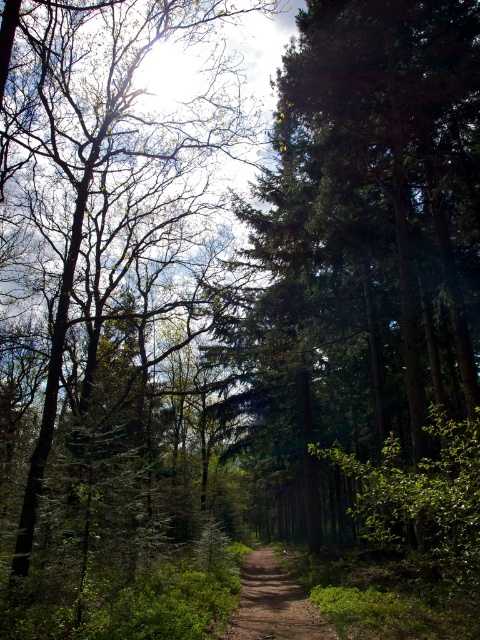
Question: Does green textured tree at center have a larger size compared to dirt path at center?

Choices:
 (A) yes
 (B) no

Answer: (A)

Question: Can you confirm if green leafy tree at center is positioned to the right of green textured tree at center?

Choices:
 (A) yes
 (B) no

Answer: (B)

Question: Can you confirm if green leafy tree at center is positioned to the left of green textured tree at center?

Choices:
 (A) yes
 (B) no

Answer: (A)

Question: Which point is farther to the camera?

Choices:
 (A) (81, 440)
 (B) (236, 618)

Answer: (A)

Question: Which point is farther from the camera taking this photo?

Choices:
 (A) (252, 580)
 (B) (82, 152)
 (C) (280, 371)

Answer: (C)

Question: Which is farther from the dirt path at center?

Choices:
 (A) green leafy tree at center
 (B) green textured tree at center

Answer: (A)